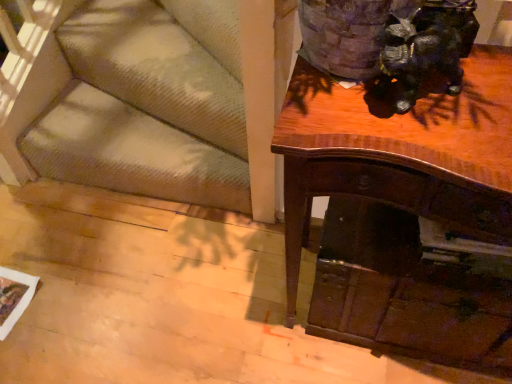
This screenshot has height=384, width=512. Find the location of `vacant area that is situated to the right of shiny black statue at upper right`. vacant area that is situated to the right of shiny black statue at upper right is located at coordinates (486, 86).